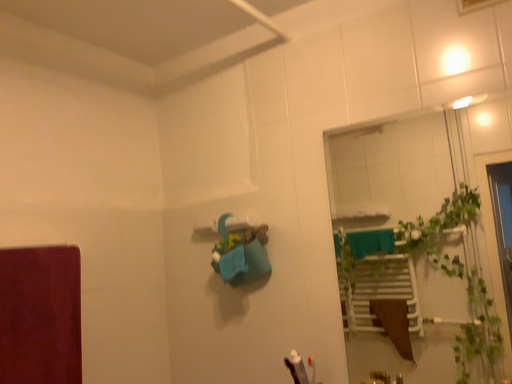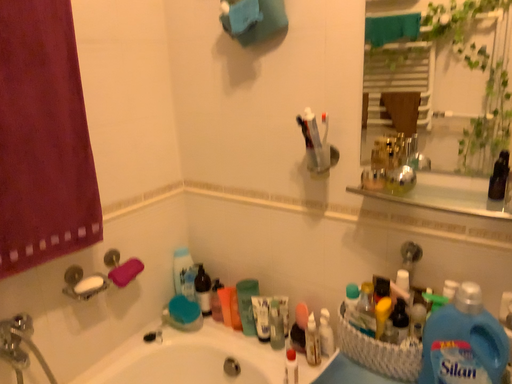
Question: How did the camera likely rotate when shooting the video?

Choices:
 (A) rotated downward
 (B) rotated upward

Answer: (A)